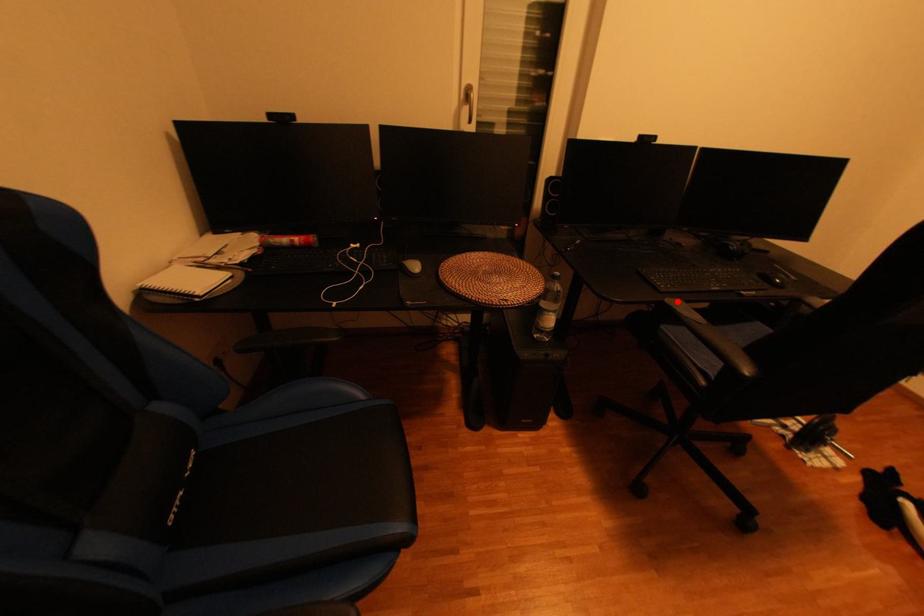
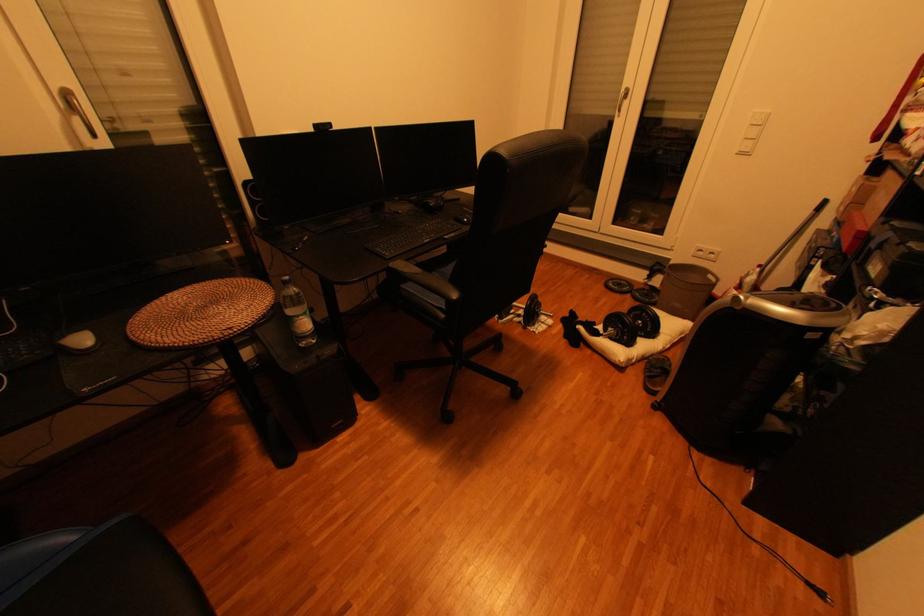
Question: I am providing you with two images of the same scene from different viewpoints. Given a red point in image1, look at the same physical point in image2. Is it:

Choices:
 (A) Closer to the viewpoint
 (B) Farther from the viewpoint

Answer: (B)